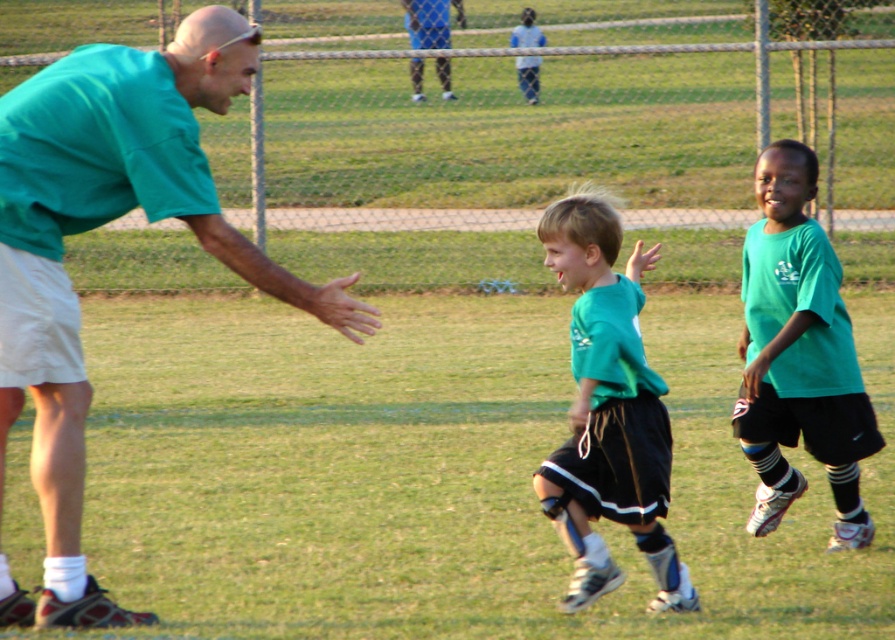
Looking at this image, you are a photographer standing at the edge of the soccer field. You want to take a photo that includes both the green matte shirt at center and the green matte shirt at right. The minimum distance between them is 26.15 inches. If your camera has a lens that can capture a width of 30 inches, will both shirts fit in the frame?

Yes, both the green matte shirt at center and the green matte shirt at right will fit in the frame since the minimum distance between them is 26.15 inches, which is less than the camera lens width of 30 inches.